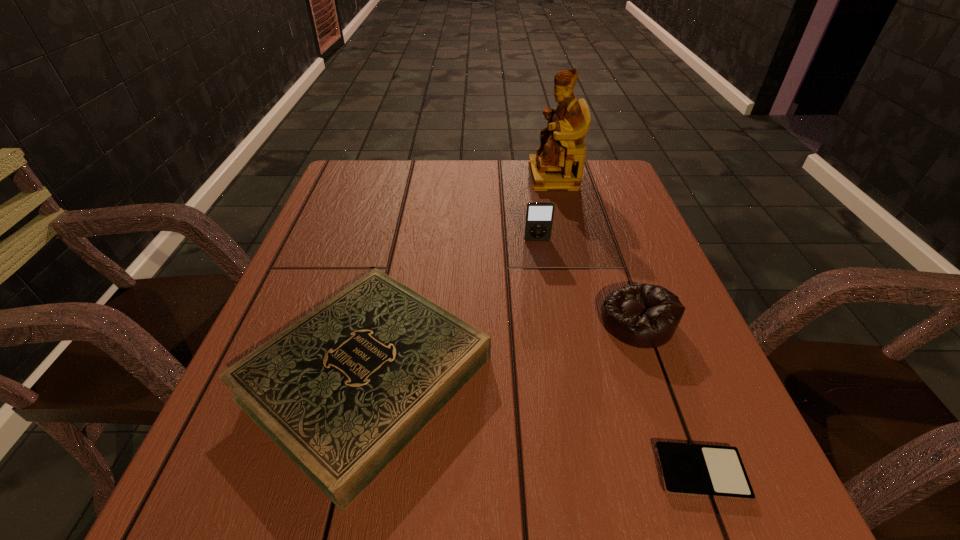
Locate an element on the screen. figurine that is at the right edge is located at coordinates (558, 164).

Where is `beanbag positioned at the right edge`? Image resolution: width=960 pixels, height=540 pixels. beanbag positioned at the right edge is located at coordinates (642, 315).

The height and width of the screenshot is (540, 960). Identify the location of iPod present at the right edge. (712, 471).

The image size is (960, 540). Identify the location of object situated at the near left corner. (343, 390).

This screenshot has height=540, width=960. Identify the location of object present at the far right corner. (558, 164).

This screenshot has width=960, height=540. I want to click on object present at the near right corner, so click(712, 471).

Identify the location of free location at the far edge. Image resolution: width=960 pixels, height=540 pixels. (482, 193).

Where is `free space at the near edge of the desktop`? This screenshot has width=960, height=540. free space at the near edge of the desktop is located at coordinates (644, 530).

The image size is (960, 540). In the image, there is a desktop. Find the location of `vacant region at the left edge`. vacant region at the left edge is located at coordinates (373, 222).

Image resolution: width=960 pixels, height=540 pixels. Identify the location of free space at the right edge of the desktop. (642, 419).